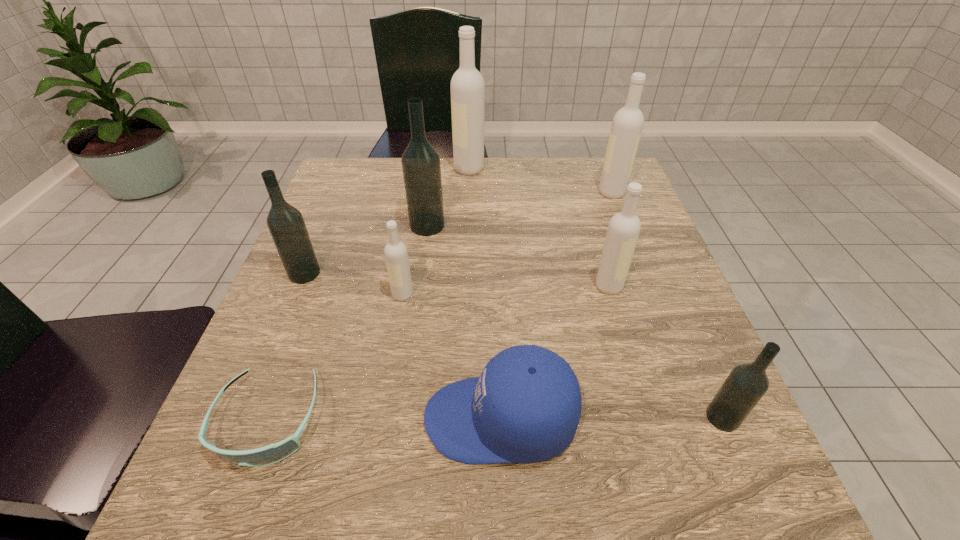
At what (x,y) coordinates should I click in order to perform the action: click on the tallest vodka. Please return your answer as a coordinate pair (x, y). Looking at the image, I should click on (467, 84).

Identify the location of the biggest white vodka. This screenshot has height=540, width=960. (467, 84).

Locate an element on the screen. the sixth nearest vodka is located at coordinates (627, 124).

At what (x,y) coordinates should I click in order to perform the action: click on the third smallest white vodka. Please return your answer as a coordinate pair (x, y). This screenshot has height=540, width=960. Looking at the image, I should click on (627, 124).

The height and width of the screenshot is (540, 960). I want to click on the farthest black vodka, so click(x=421, y=167).

In order to click on the biggest black vodka in this screenshot , I will do `click(421, 167)`.

I want to click on the seventh object from left to right, so click(x=624, y=227).

At what (x,y) coordinates should I click in order to perform the action: click on the third vodka from right to left. Please return your answer as a coordinate pair (x, y). Looking at the image, I should click on (624, 227).

The image size is (960, 540). I want to click on the leftmost vodka, so click(286, 224).

The image size is (960, 540). Find the location of `the second nearest black vodka`. the second nearest black vodka is located at coordinates (286, 224).